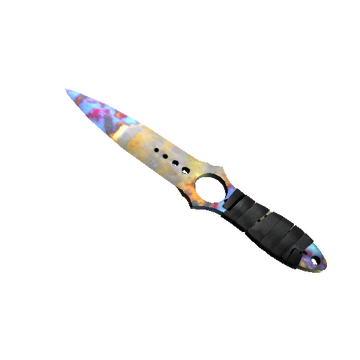
The image size is (360, 360). Identify the location of handle. (274, 230).